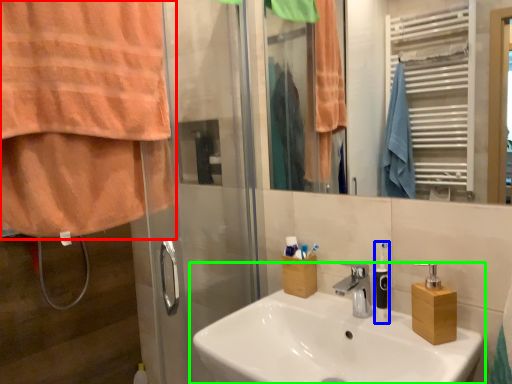
Question: Estimate the real-world distances between objects in this image. Which object is farther from curtain (highlighted by a red box), soap dispenser (highlighted by a blue box) or sink (highlighted by a green box)?

Choices:
 (A) soap dispenser
 (B) sink

Answer: (A)